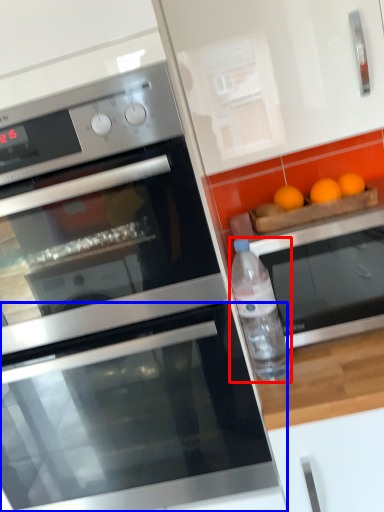
Question: Among these objects, which one is farthest to the camera, bottle (highlighted by a red box) or oven (highlighted by a blue box)?

Choices:
 (A) bottle
 (B) oven

Answer: (A)